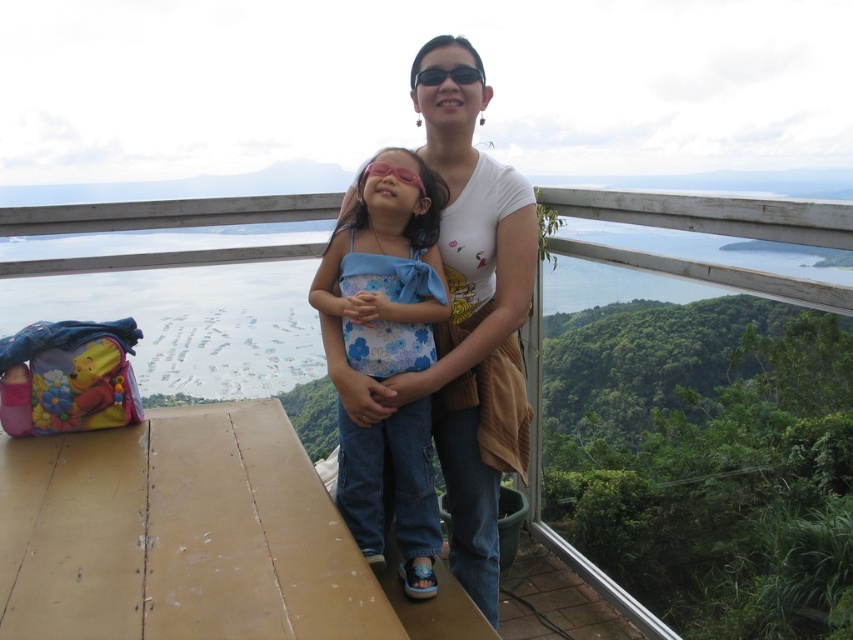
Question: Does white cotton shirt at center appear over floral fabric swimsuit at center?

Choices:
 (A) no
 (B) yes

Answer: (B)

Question: Can you confirm if white cotton shirt at center is positioned below floral fabric swimsuit at center?

Choices:
 (A) no
 (B) yes

Answer: (A)

Question: Does white cotton shirt at center have a greater width compared to floral fabric swimsuit at center?

Choices:
 (A) no
 (B) yes

Answer: (B)

Question: Which point is closer to the camera?

Choices:
 (A) (525, 316)
 (B) (405, 320)

Answer: (B)